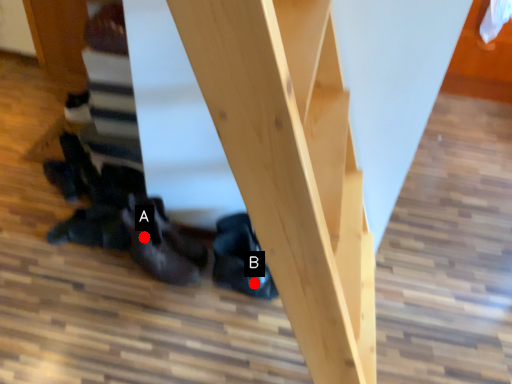
Question: Two points are circled on the image, labeled by A and B beside each circle. Which point appears farthest from the camera in this image?

Choices:
 (A) A is further
 (B) B is further

Answer: (B)